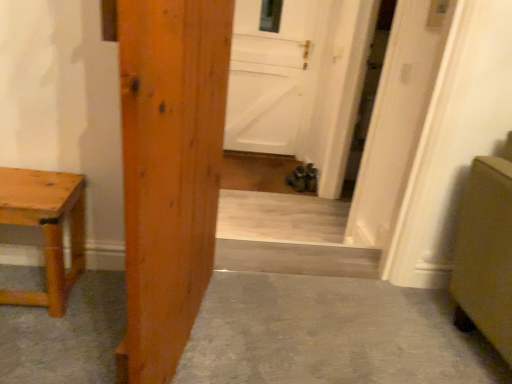
The width and height of the screenshot is (512, 384). In order to click on free region on the left part of white matte door at center, the 2th door from the back in this screenshot , I will do `click(280, 207)`.